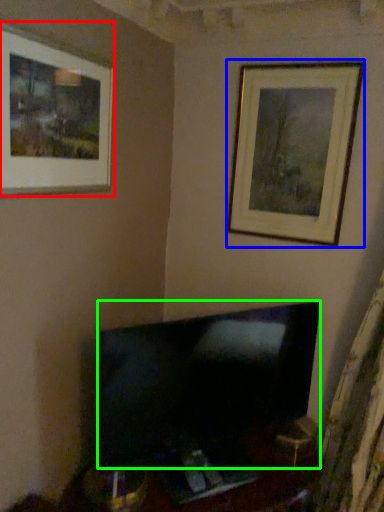
Question: Estimate the real-world distances between objects in this image. Which object is closer to picture frame (highlighted by a red box), picture frame (highlighted by a blue box) or television (highlighted by a green box)?

Choices:
 (A) picture frame
 (B) television

Answer: (A)